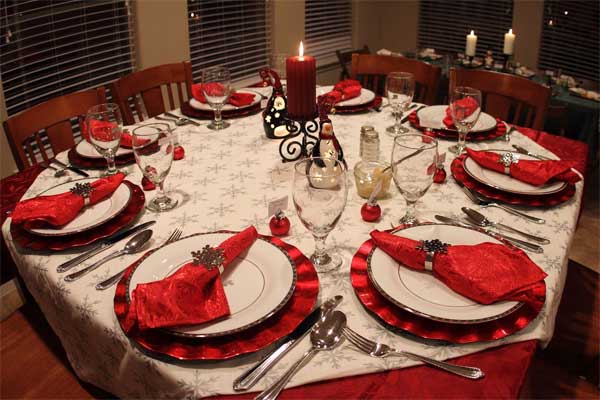
This screenshot has height=400, width=600. I want to click on chairs, so click(497, 86), click(436, 70), click(167, 75), click(76, 108), click(340, 56), click(53, 371).